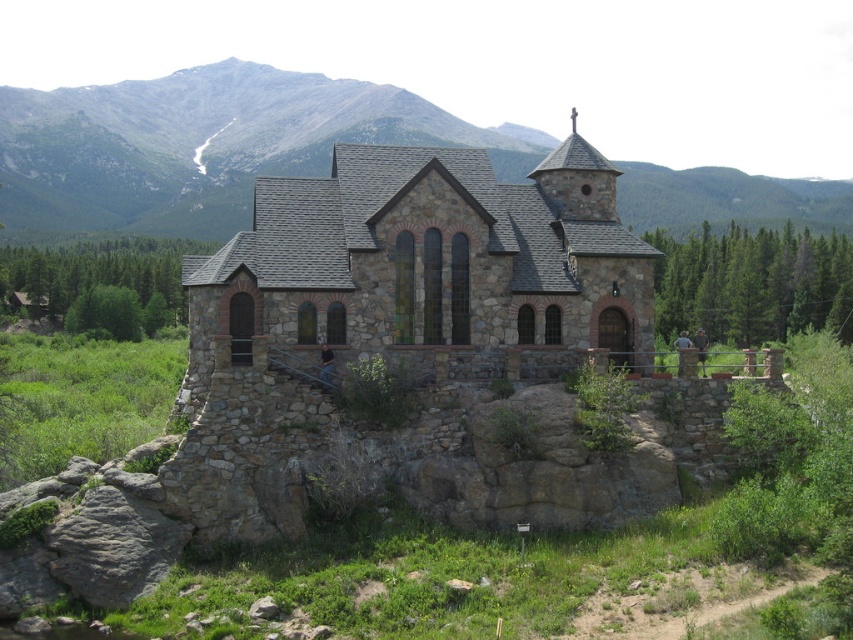
Question: Is stone church at center bigger than green leafy tree at left?

Choices:
 (A) no
 (B) yes

Answer: (A)

Question: Can you confirm if green coniferous tree at right is positioned above green leafy tree at left?

Choices:
 (A) no
 (B) yes

Answer: (A)

Question: Among these objects, which one is farthest from the camera?

Choices:
 (A) green leafy tree at left
 (B) green coniferous tree at right
 (C) gray stone mountain at upper center
 (D) stone church at center

Answer: (C)

Question: Is the position of gray stone mountain at upper center less distant than that of green coniferous tree at right?

Choices:
 (A) yes
 (B) no

Answer: (B)

Question: Estimate the real-world distances between objects in this image. Which object is farther from the gray stone mountain at upper center?

Choices:
 (A) green leafy tree at left
 (B) green coniferous tree at right
 (C) stone church at center

Answer: (C)

Question: Which of the following is the closest to the observer?

Choices:
 (A) (659, 308)
 (B) (195, 92)
 (C) (172, 250)
 (D) (376, 246)

Answer: (D)